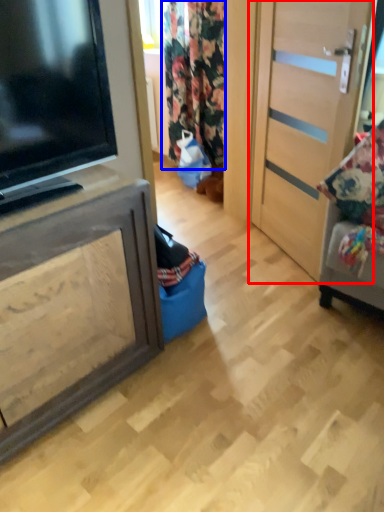
Question: Which object appears closest to the camera in this image, door (highlighted by a red box) or curtain (highlighted by a blue box)?

Choices:
 (A) door
 (B) curtain

Answer: (A)